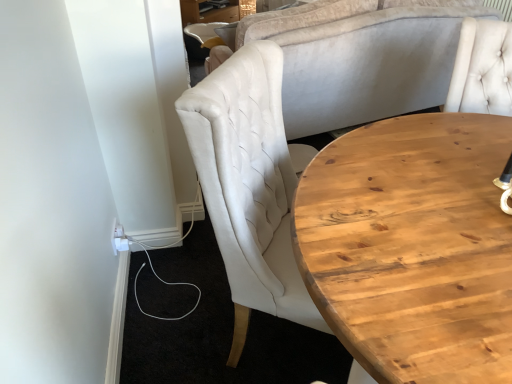
Locate an element on the screen. light brown wooden coffee table at right is located at coordinates (412, 247).

What is the approximate width of light brown wooden coffee table at right?

The width of light brown wooden coffee table at right is 20.90 inches.

The width and height of the screenshot is (512, 384). Describe the element at coordinates (412, 247) in the screenshot. I see `light brown wooden coffee table at right` at that location.

What do you see at coordinates (203, 30) in the screenshot? This screenshot has width=512, height=384. I see `matte white chair at upper left` at bounding box center [203, 30].

Locate an element on the screen. This screenshot has height=384, width=512. matte white chair at upper left is located at coordinates (203, 30).

I want to click on light brown wooden coffee table at right, so pyautogui.click(x=412, y=247).

Which object is positioned more to the left, matte white chair at upper left or light brown wooden coffee table at right?

Positioned to the left is matte white chair at upper left.

Which object is closer to the camera, matte white chair at upper left or light brown wooden coffee table at right?

light brown wooden coffee table at right is closer to the camera.

Considering the positions of point (206, 23) and point (374, 146), is point (206, 23) closer or farther from the camera than point (374, 146)?

Point (206, 23) is farther from the camera than point (374, 146).

From the image's perspective, relative to light brown wooden coffee table at right, is matte white chair at upper left above or below?

Based on their image positions, matte white chair at upper left is located above light brown wooden coffee table at right.

From a real-world perspective, between matte white chair at upper left and light brown wooden coffee table at right, who is vertically lower?

From a 3D spatial view, matte white chair at upper left is below.

Which of these two, matte white chair at upper left or light brown wooden coffee table at right, is wider?

light brown wooden coffee table at right is wider.

Considering the relative sizes of matte white chair at upper left and light brown wooden coffee table at right in the image provided, is matte white chair at upper left shorter than light brown wooden coffee table at right?

Yes, matte white chair at upper left is shorter than light brown wooden coffee table at right.

Considering the relative sizes of matte white chair at upper left and light brown wooden coffee table at right in the image provided, is matte white chair at upper left bigger than light brown wooden coffee table at right?

Incorrect, matte white chair at upper left is not larger than light brown wooden coffee table at right.

Is light brown wooden coffee table at right surrounded by matte white chair at upper left?

That's incorrect, light brown wooden coffee table at right is not inside matte white chair at upper left.

Are matte white chair at upper left and light brown wooden coffee table at right located far from each other?

Yes, matte white chair at upper left and light brown wooden coffee table at right are quite far apart.

Could you tell me if matte white chair at upper left is turned towards light brown wooden coffee table at right?

No, matte white chair at upper left is not turned towards light brown wooden coffee table at right.

Can you tell me how much matte white chair at upper left and light brown wooden coffee table at right differ in facing direction?

There is a 53.7-degree angle between the facing directions of matte white chair at upper left and light brown wooden coffee table at right.

Locate an element on the screen. chair below the light brown wooden coffee table at right (from a real-world perspective) is located at coordinates (203, 30).

Which object is positioned more to the left, light brown wooden coffee table at right or matte white chair at upper left?

matte white chair at upper left is more to the left.

Is light brown wooden coffee table at right positioned behind matte white chair at upper left?

No, light brown wooden coffee table at right is in front of matte white chair at upper left.

Does point (372, 192) come in front of point (197, 39)?

Yes, it is in front of point (197, 39).

From the image's perspective, is light brown wooden coffee table at right above or below matte white chair at upper left?

Based on their image positions, light brown wooden coffee table at right is located beneath matte white chair at upper left.

From a real-world perspective, is light brown wooden coffee table at right on matte white chair at upper left?

Yes, from a real-world perspective, light brown wooden coffee table at right is above matte white chair at upper left.

Considering the relative sizes of light brown wooden coffee table at right and matte white chair at upper left in the image provided, is light brown wooden coffee table at right thinner than matte white chair at upper left?

In fact, light brown wooden coffee table at right might be wider than matte white chair at upper left.

Can you confirm if light brown wooden coffee table at right is taller than matte white chair at upper left?

Indeed, light brown wooden coffee table at right has a greater height compared to matte white chair at upper left.

Who is smaller, light brown wooden coffee table at right or matte white chair at upper left?

With smaller size is matte white chair at upper left.

Is light brown wooden coffee table at right not inside matte white chair at upper left?

light brown wooden coffee table at right lies outside matte white chair at upper left's area.

Is there a large distance between light brown wooden coffee table at right and matte white chair at upper left?

Indeed, light brown wooden coffee table at right is not near matte white chair at upper left.

Is matte white chair at upper left at the back of light brown wooden coffee table at right?

No, matte white chair at upper left is not at the back of light brown wooden coffee table at right.

How different are the orientations of light brown wooden coffee table at right and matte white chair at upper left in degrees?

The angle between the facing direction of light brown wooden coffee table at right and the facing direction of matte white chair at upper left is 53.7 degrees.

Where is `chair behind the light brown wooden coffee table at right`? chair behind the light brown wooden coffee table at right is located at coordinates (203, 30).

This screenshot has height=384, width=512. I want to click on chair that is under the light brown wooden coffee table at right (from a real-world perspective), so click(x=203, y=30).

Identify the location of chair above the light brown wooden coffee table at right (from the image's perspective). (203, 30).